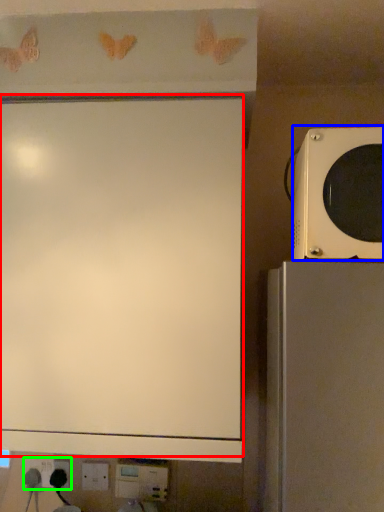
Question: Which object is the closest to the projection screen (highlighted by a red box)? Choose among these: microwave oven (highlighted by a blue box) or electric outlet (highlighted by a green box).

Choices:
 (A) microwave oven
 (B) electric outlet

Answer: (A)